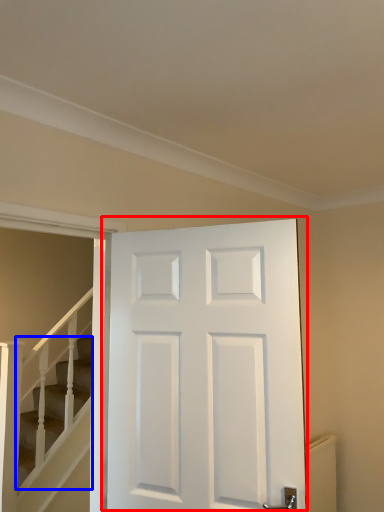
Question: Which point is closer to the camera, door (highlighted by a red box) or stairs (highlighted by a blue box)?

Choices:
 (A) door
 (B) stairs

Answer: (A)